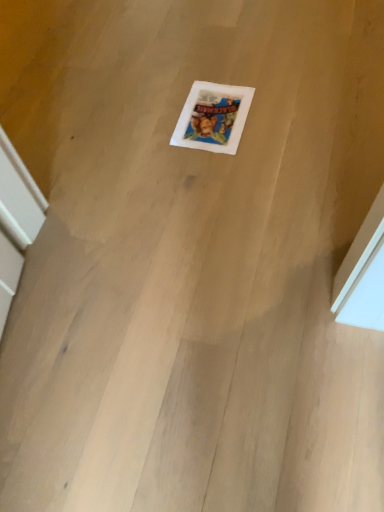
Question: Should I look upward or downward to see white matte picture frame at center?

Choices:
 (A) down
 (B) up

Answer: (B)